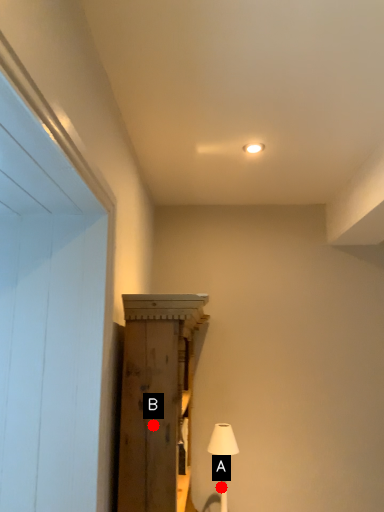
Question: Two points are circled on the image, labeled by A and B beside each circle. Which of the following is the closest to the observer?

Choices:
 (A) A is closer
 (B) B is closer

Answer: (B)